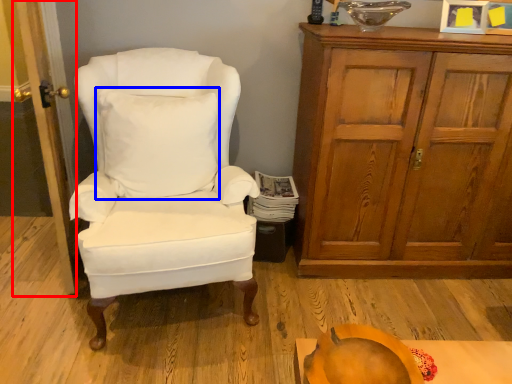
Question: Which object is closer to the camera taking this photo, door (highlighted by a red box) or pillow (highlighted by a blue box)?

Choices:
 (A) door
 (B) pillow

Answer: (A)